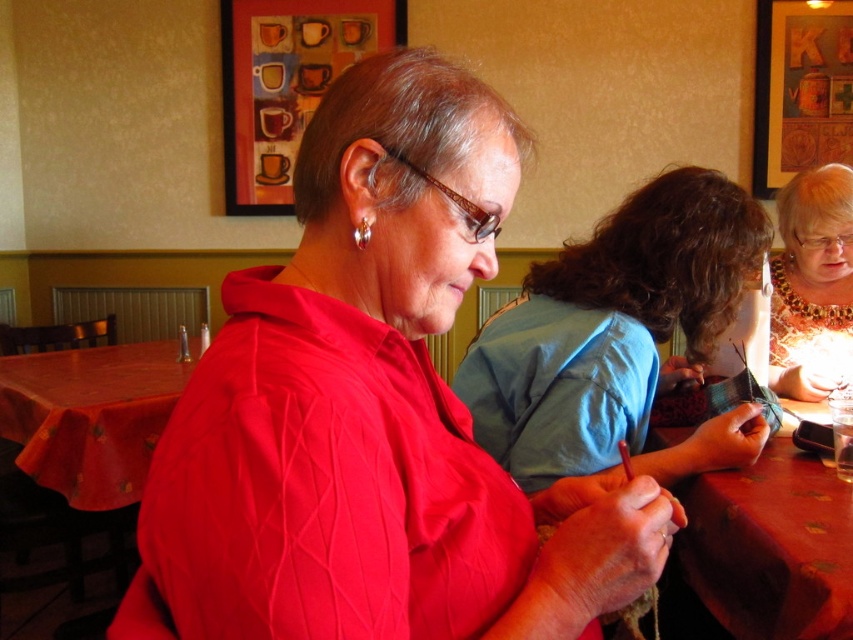
You are a customer in a restaurant and want to choose a seat between the matte blue shirt at center and the gold beaded necklace at upper right. Which seat is wider?

The matte blue shirt at center is wider than the gold beaded necklace at upper right, so the seat at the matte blue shirt at center is wider.

You are a customer at the restaurant and want to sit at the wooden table at center. There is a person wearing a matte blue shirt at center blocking your path. Can you walk around them to reach the table?

The matte blue shirt at center is to the left of the wooden table at center, so you can walk around to the right side of the matte blue shirt at center to reach the wooden table at center.